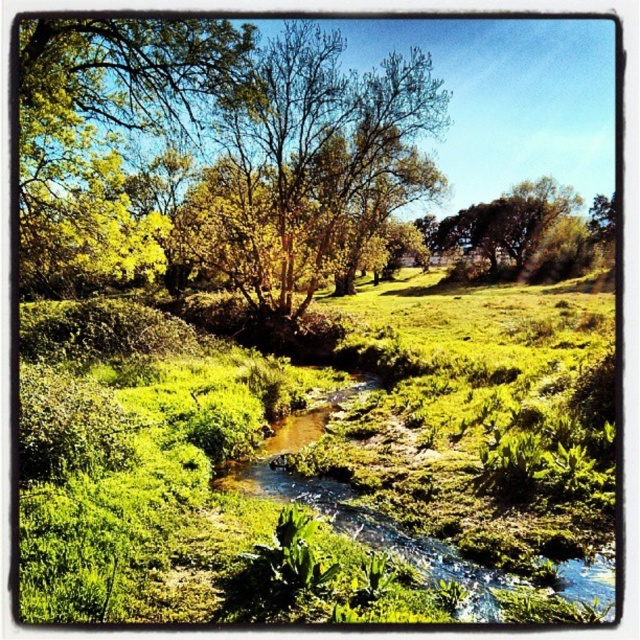
You are standing at the edge of the clear water stream at center and want to walk towards the green leafy tree at upper left. Which direction should you head?

The green leafy tree at upper left is positioned on the left side of clear water stream at center, so you should head to the left to reach it.

You are standing at the point with coordinates point (120, 24) and want to walk to the point with coordinates point (572, 515). Which direction should you move to reach your destination?

To reach point (572, 515) from point (120, 24), you should move towards the upper right direction since point (572, 515) is located in front of point (120, 24).

You are standing at the edge of the stream and notice a point marked at coordinates [321,458] in the scene. According to the image, what is located at that point?

The point at coordinates [321,458] indicates green leafy grass at center.